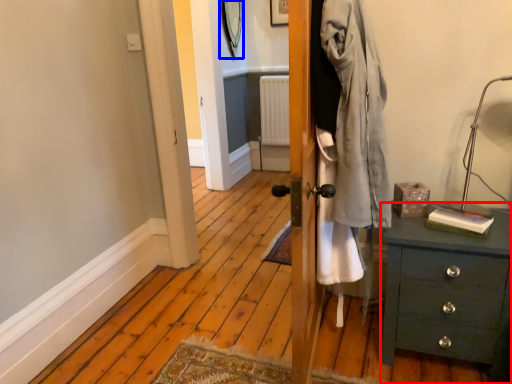
Question: Which object is further to the camera taking this photo, chest of drawers (highlighted by a red box) or mirror (highlighted by a blue box)?

Choices:
 (A) chest of drawers
 (B) mirror

Answer: (B)